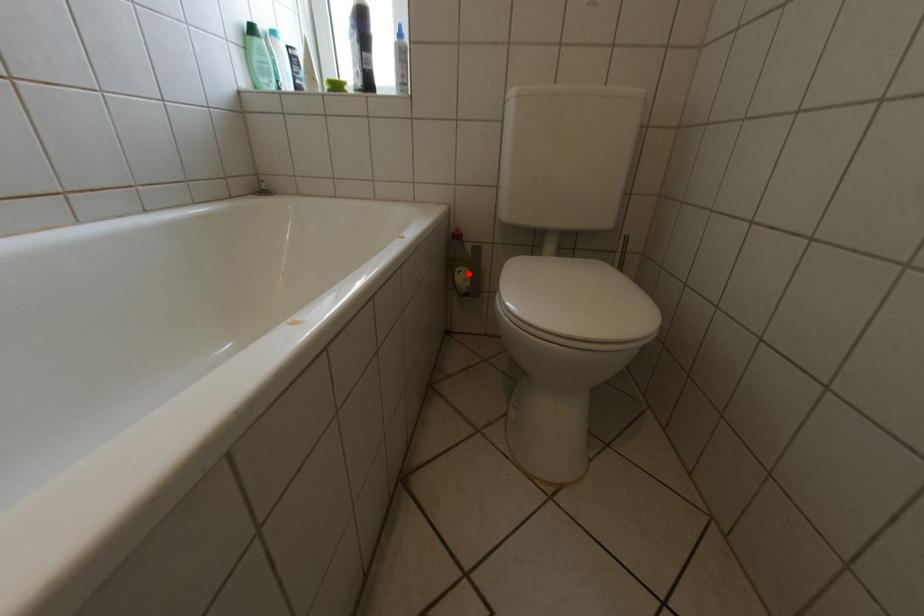
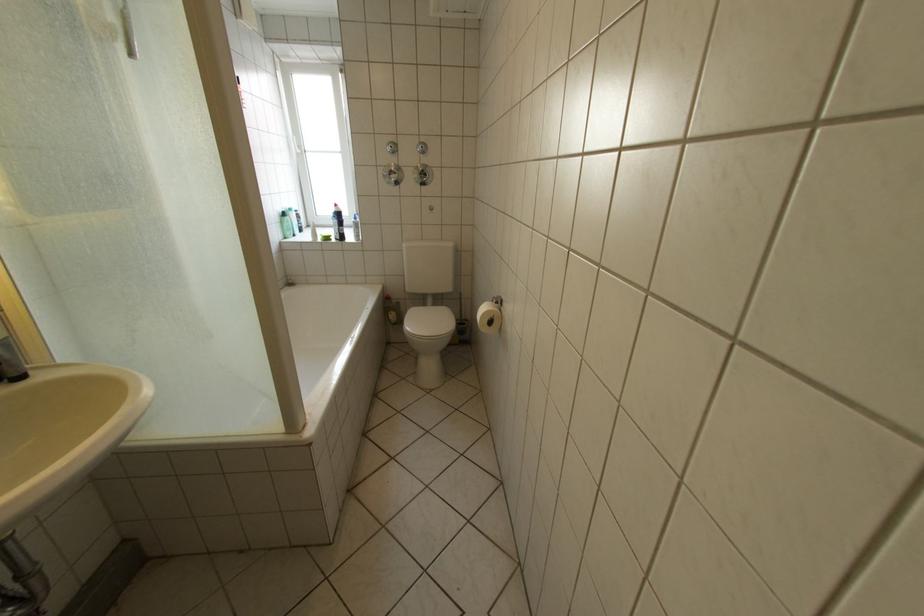
Question: I am providing you with two images of the same scene from different viewpoints. Image1 has a red point marked. In image2, the corresponding 3D location appears at what relative position? Reply with the corresponding letter.

Choices:
 (A) Closer
 (B) Farther

Answer: (B)